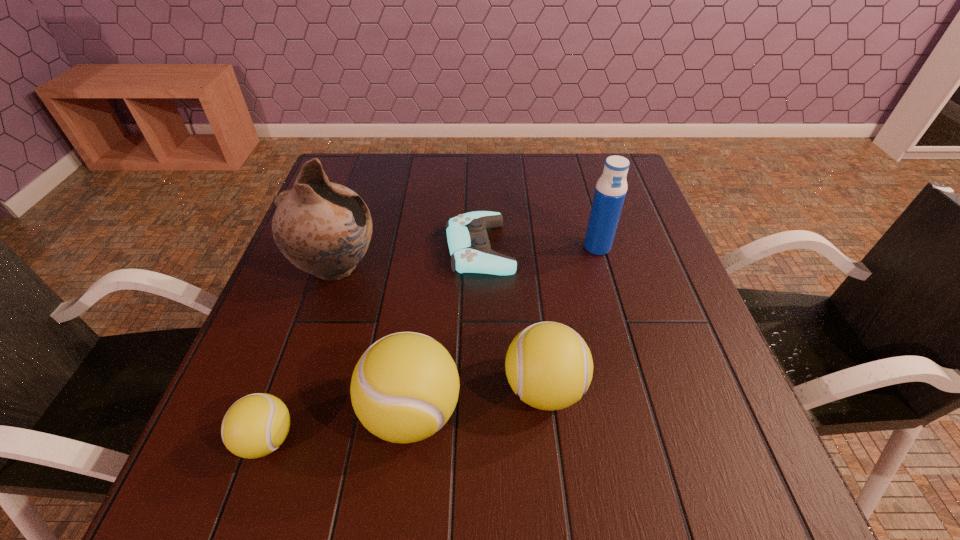
Find the location of `free space between the second tennis ball from left to right and the rightmost object`. free space between the second tennis ball from left to right and the rightmost object is located at coordinates (504, 330).

The image size is (960, 540). What are the coordinates of `unoccupied position between the second tennis ball from right to left and the rightmost object` in the screenshot? It's located at (504, 330).

The width and height of the screenshot is (960, 540). I want to click on the third closest object to the leftmost tennis ball, so click(x=549, y=365).

Identify which object is the fourth closest to the second tennis ball from left to right. Please provide its 2D coordinates. Your answer should be formatted as a tuple, i.e. [(x, y)], where the tuple contains the x and y coordinates of a point satisfying the conditions above.

[(469, 246)]

Locate an element on the screen. tennis ball that is the closest to the shortest object is located at coordinates [549, 365].

Identify which tennis ball is the closest to the third shortest object. Please provide its 2D coordinates. Your answer should be formatted as a tuple, i.e. [(x, y)], where the tuple contains the x and y coordinates of a point satisfying the conditions above.

[(404, 388)]

Find the location of a particular element. The width and height of the screenshot is (960, 540). free space that satisfies the following two spatial constraints: 1. from the spout of the second shortest tennis ball; 2. on the right side of the pottery is located at coordinates (297, 389).

The height and width of the screenshot is (540, 960). What are the coordinates of `vacant space that satisfies the following two spatial constraints: 1. on the back side of the second tennis ball from right to left; 2. on the right side of the rightmost object` in the screenshot? It's located at pyautogui.click(x=431, y=247).

Where is `free location that satisfies the following two spatial constraints: 1. on the back side of the second tennis ball from right to left; 2. from the spout of the pottery`? free location that satisfies the following two spatial constraints: 1. on the back side of the second tennis ball from right to left; 2. from the spout of the pottery is located at coordinates (429, 268).

Identify the location of blank space that satisfies the following two spatial constraints: 1. on the back side of the shortest object; 2. on the right side of the leftmost tennis ball. This screenshot has height=540, width=960. (334, 248).